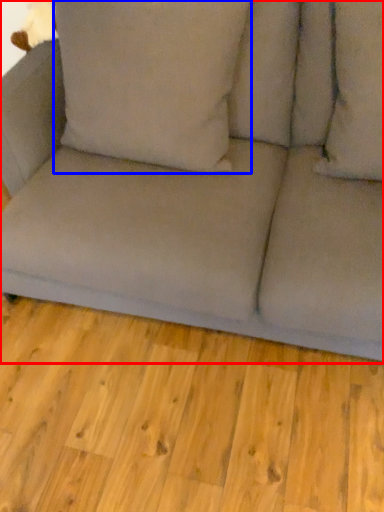
Question: Which of the following is the farthest to the observer, studio couch (highlighted by a red box) or pillow (highlighted by a blue box)?

Choices:
 (A) studio couch
 (B) pillow

Answer: (B)